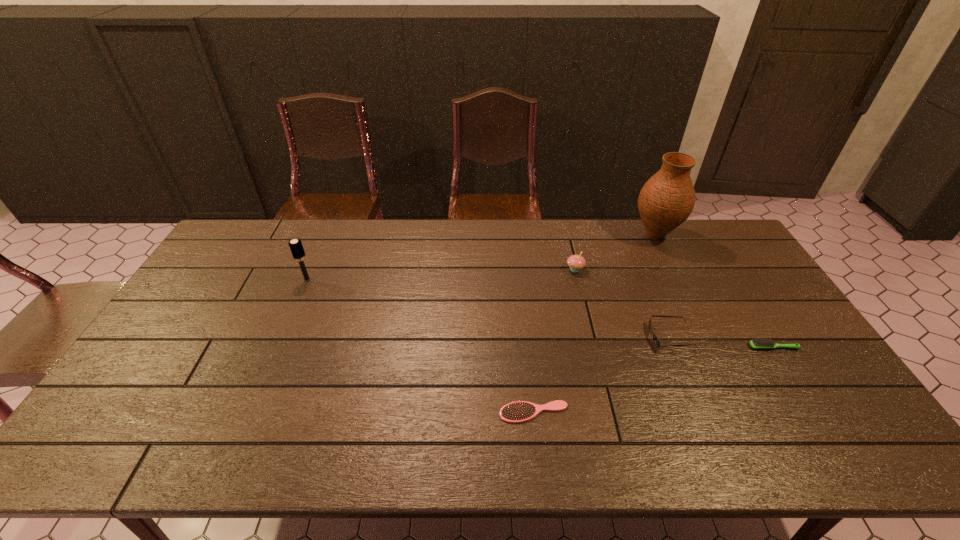
Locate an element on the screen. The image size is (960, 540). object that is at the right edge is located at coordinates (755, 344).

Locate an element on the screen. The image size is (960, 540). vacant space at the far edge is located at coordinates (350, 237).

The height and width of the screenshot is (540, 960). In the image, there is a desktop. What are the coordinates of `vacant space at the near edge` in the screenshot? It's located at (405, 453).

Find the location of a particular element. This screenshot has width=960, height=540. vacant space at the left edge is located at coordinates (158, 405).

In the image, there is a desktop. Where is `free space at the right edge`? free space at the right edge is located at coordinates (741, 313).

Find the location of a particular element. free spot between the rightmost hairbrush and the second tallest object is located at coordinates (540, 313).

Locate an element on the screen. The image size is (960, 540). vacant space that is in between the leftmost object and the sunglasses is located at coordinates (489, 308).

Locate an element on the screen. The height and width of the screenshot is (540, 960). unoccupied area between the rightmost object and the nearest hairbrush is located at coordinates (654, 380).

Where is `blank region between the farthest object and the rightmost hairbrush`? blank region between the farthest object and the rightmost hairbrush is located at coordinates (714, 291).

The image size is (960, 540). I want to click on vacant space in between the fourth shortest object and the rightmost object, so click(x=674, y=308).